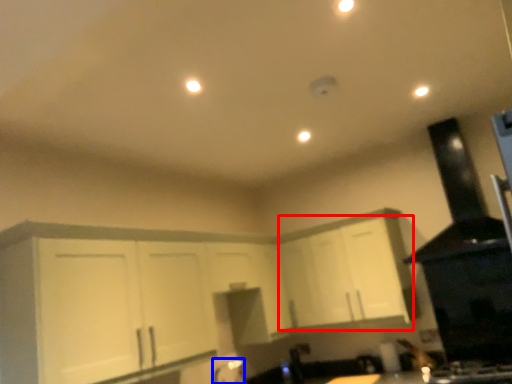
Question: Which of the following is the farthest to the observer, cabinetry (highlighted by a red box) or faucet (highlighted by a blue box)?

Choices:
 (A) cabinetry
 (B) faucet

Answer: (B)